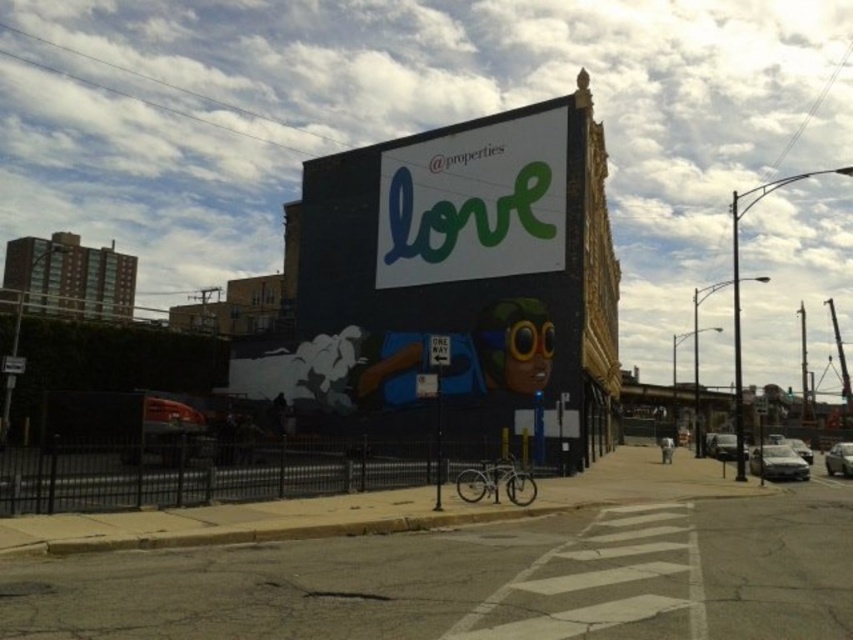
Question: Considering the relative positions of metallic silver sedan at center-right and silver metallic sedan at lower right in the image provided, where is metallic silver sedan at center-right located with respect to silver metallic sedan at lower right?

Choices:
 (A) above
 (B) below

Answer: (A)

Question: Can you confirm if silver metallic sedan at center is positioned to the right of silver metallic sedan at lower right?

Choices:
 (A) no
 (B) yes

Answer: (B)

Question: Considering the real-world distances, which object is farthest from the green matte sign at upper center?

Choices:
 (A) silver metallic sedan at lower right
 (B) silver metallic sedan at center
 (C) metallic silver sedan at center-right

Answer: (A)

Question: Which point is farther from the camera taking this photo?

Choices:
 (A) (360, 170)
 (B) (827, 468)
 (C) (792, 440)

Answer: (C)

Question: Which is farther from the metallic silver sedan at center-right?

Choices:
 (A) silver metallic sedan at center
 (B) silver metallic sedan at lower right
 (C) matte black billboard at center
 (D) green matte sign at upper center

Answer: (C)

Question: Where is green matte sign at upper center located in relation to satin silver sedan at right in the image?

Choices:
 (A) above
 (B) below

Answer: (A)